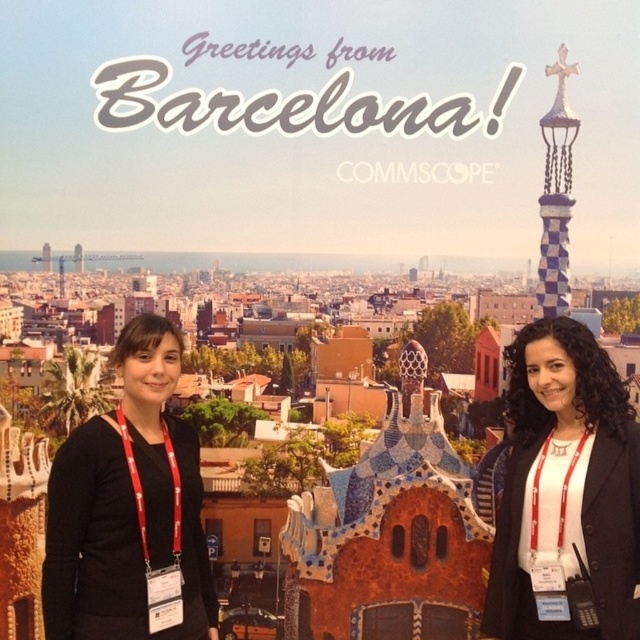
Is black matte jacket at right positioned behind black fabric at left?

No, it is not.

Where is `black matte jacket at right`? This screenshot has width=640, height=640. black matte jacket at right is located at coordinates (564, 486).

Identify the location of black matte jacket at right. (564, 486).